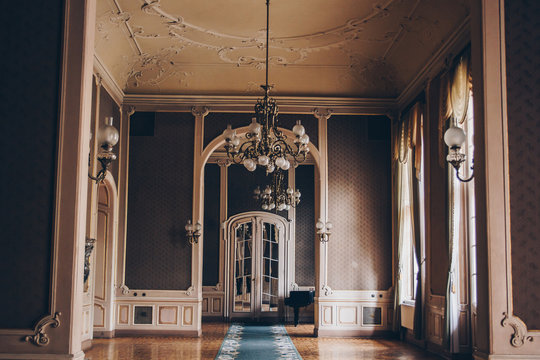
Image resolution: width=540 pixels, height=360 pixels. What are the coordinates of `windows` in the screenshot? It's located at (470, 257), (413, 258).